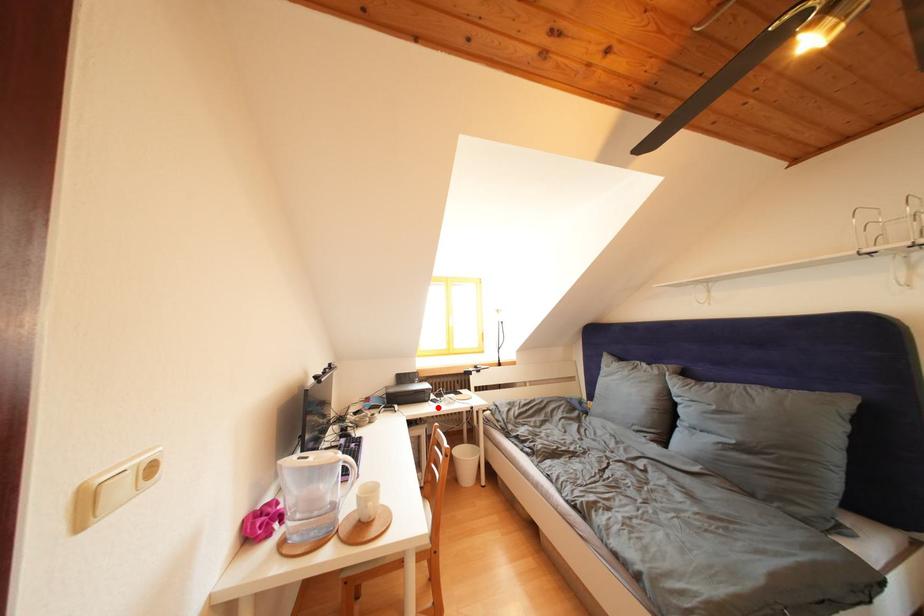
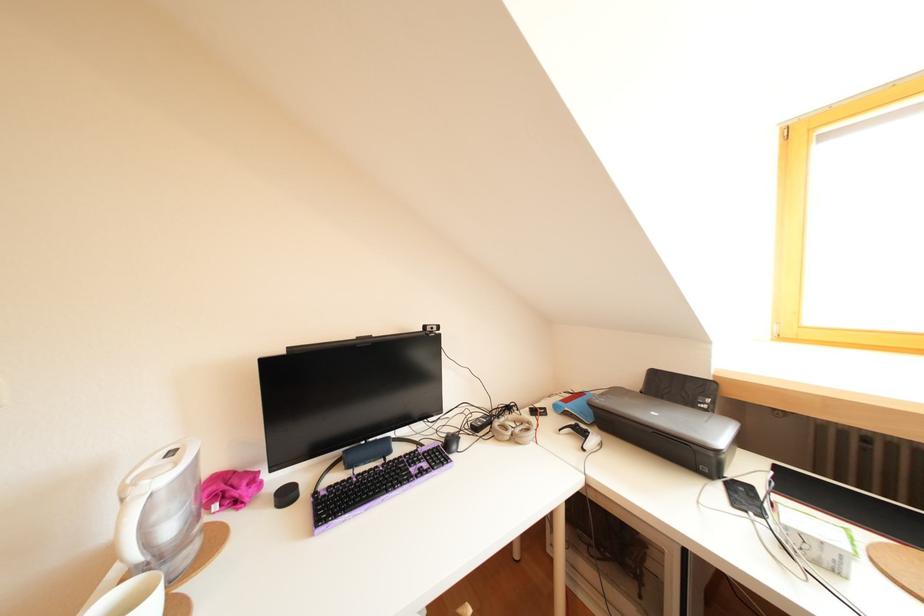
In the second image, find the point that corresponds to the highlighted location in the first image.

(727, 490)